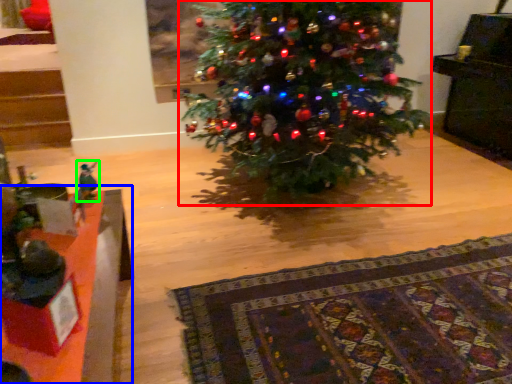
Question: Which object is positioned farthest from christmas tree (highlighted by a red box)? Select from table (highlighted by a blue box) and toy (highlighted by a green box).

Choices:
 (A) table
 (B) toy

Answer: (B)